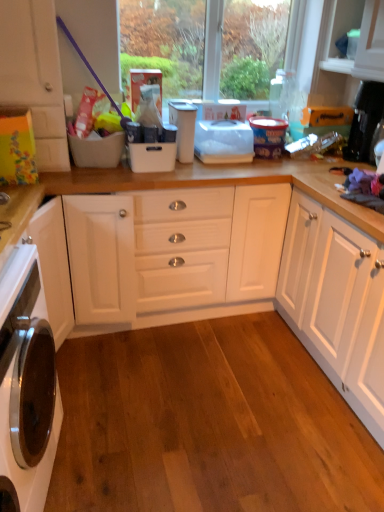
Question: Is white plastic container at center at the left side of white glossy oven at lower left?

Choices:
 (A) yes
 (B) no

Answer: (B)

Question: Is white plastic container at center outside white glossy oven at lower left?

Choices:
 (A) yes
 (B) no

Answer: (A)

Question: Considering the relative sizes of white plastic container at center and white glossy oven at lower left in the image provided, is white plastic container at center thinner than white glossy oven at lower left?

Choices:
 (A) no
 (B) yes

Answer: (B)

Question: From the image's perspective, does white plastic container at center appear higher than white glossy oven at lower left?

Choices:
 (A) no
 (B) yes

Answer: (B)

Question: Is there a large distance between white plastic container at center and white glossy oven at lower left?

Choices:
 (A) yes
 (B) no

Answer: (A)

Question: Based on their positions, is white glossy oven at lower left located to the left or right of white plastic container at center?

Choices:
 (A) right
 (B) left

Answer: (B)

Question: Is white glossy oven at lower left in front of or behind white plastic container at center in the image?

Choices:
 (A) front
 (B) behind

Answer: (A)

Question: In terms of size, does white glossy oven at lower left appear bigger or smaller than white plastic container at center?

Choices:
 (A) big
 (B) small

Answer: (A)

Question: From the image's perspective, is white glossy oven at lower left above or below white plastic container at center?

Choices:
 (A) below
 (B) above

Answer: (A)

Question: Relative to white matte cabinet at left, is white plastic container at center in front or behind?

Choices:
 (A) behind
 (B) front

Answer: (A)

Question: Looking at their shapes, would you say white plastic container at center is wider or thinner than white matte cabinet at left?

Choices:
 (A) wide
 (B) thin

Answer: (B)

Question: In the image, is white plastic container at center on the left side or the right side of white matte cabinet at left?

Choices:
 (A) right
 (B) left

Answer: (A)

Question: Does point (187, 101) appear closer or farther from the camera than point (21, 62)?

Choices:
 (A) closer
 (B) farther

Answer: (B)

Question: From a real-world perspective, relative to white matte cabinet at left, is transparent plastic window screen at upper center vertically above or below?

Choices:
 (A) above
 (B) below

Answer: (A)

Question: From the image's perspective, relative to white matte cabinet at left, is transparent plastic window screen at upper center above or below?

Choices:
 (A) below
 (B) above

Answer: (B)